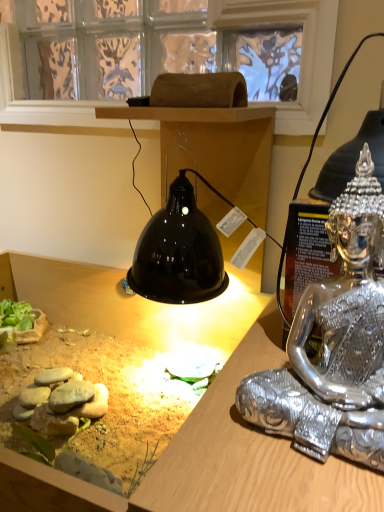
Question: Can you confirm if matte black lamp at upper center is thinner than silver metallic statue at right?

Choices:
 (A) no
 (B) yes

Answer: (A)

Question: Is matte black lamp at upper center next to silver metallic statue at right?

Choices:
 (A) no
 (B) yes

Answer: (A)

Question: Does matte black lamp at upper center turn towards silver metallic statue at right?

Choices:
 (A) no
 (B) yes

Answer: (A)

Question: Is matte black lamp at upper center further to camera compared to silver metallic statue at right?

Choices:
 (A) yes
 (B) no

Answer: (B)

Question: Can you confirm if matte black lamp at upper center is positioned to the right of silver metallic statue at right?

Choices:
 (A) no
 (B) yes

Answer: (A)

Question: Considering the positions of point (198, 475) and point (327, 77), is point (198, 475) closer or farther from the camera than point (327, 77)?

Choices:
 (A) farther
 (B) closer

Answer: (B)

Question: Is matte black lamp at upper center situated inside transparent glass window screen at upper center or outside?

Choices:
 (A) inside
 (B) outside

Answer: (B)

Question: Looking at their shapes, would you say matte black lamp at upper center is wider or thinner than transparent glass window screen at upper center?

Choices:
 (A) wide
 (B) thin

Answer: (A)

Question: In the image, is matte black lamp at upper center positioned in front of or behind transparent glass window screen at upper center?

Choices:
 (A) behind
 (B) front

Answer: (B)

Question: Which is correct: transparent glass window screen at upper center is inside silver metallic statue at right, or outside of it?

Choices:
 (A) inside
 (B) outside

Answer: (B)

Question: Considering the relative positions of transparent glass window screen at upper center and silver metallic statue at right in the image provided, is transparent glass window screen at upper center to the left or to the right of silver metallic statue at right?

Choices:
 (A) left
 (B) right

Answer: (A)

Question: Based on their sizes in the image, would you say transparent glass window screen at upper center is bigger or smaller than silver metallic statue at right?

Choices:
 (A) small
 (B) big

Answer: (B)

Question: From the image's perspective, is transparent glass window screen at upper center above or below silver metallic statue at right?

Choices:
 (A) above
 (B) below

Answer: (A)

Question: Is transparent glass window screen at upper center taller or shorter than matte black lamp at upper center?

Choices:
 (A) short
 (B) tall

Answer: (B)

Question: In the image, is transparent glass window screen at upper center on the left side or the right side of matte black lamp at upper center?

Choices:
 (A) right
 (B) left

Answer: (A)